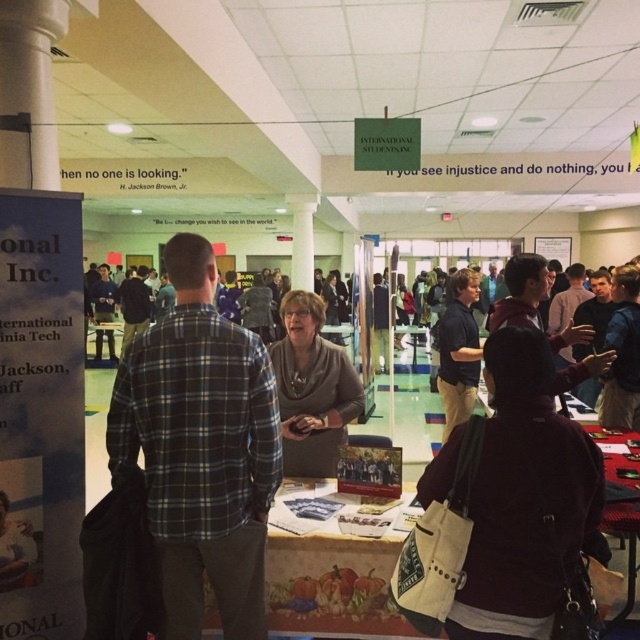
Is plaid flannel shirt at center shorter than maroon fabric jacket at center?

No.

Who is more distant from viewer, (276, 460) or (445, 628)?

Point (276, 460)

At what (x,y) coordinates should I click in order to perform the action: click on plaid flannel shirt at center. Please return your answer as a coordinate pair (x, y). Looking at the image, I should click on tap(200, 449).